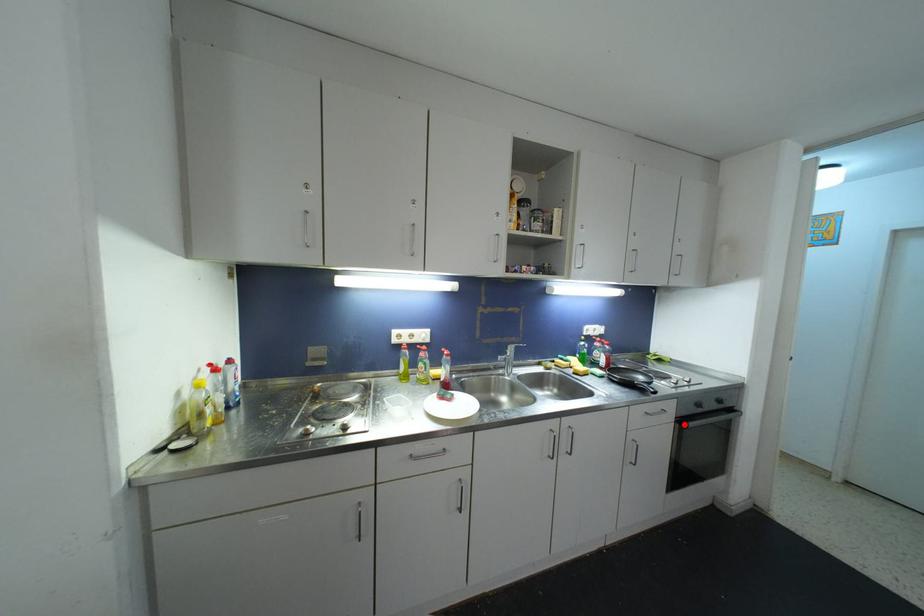
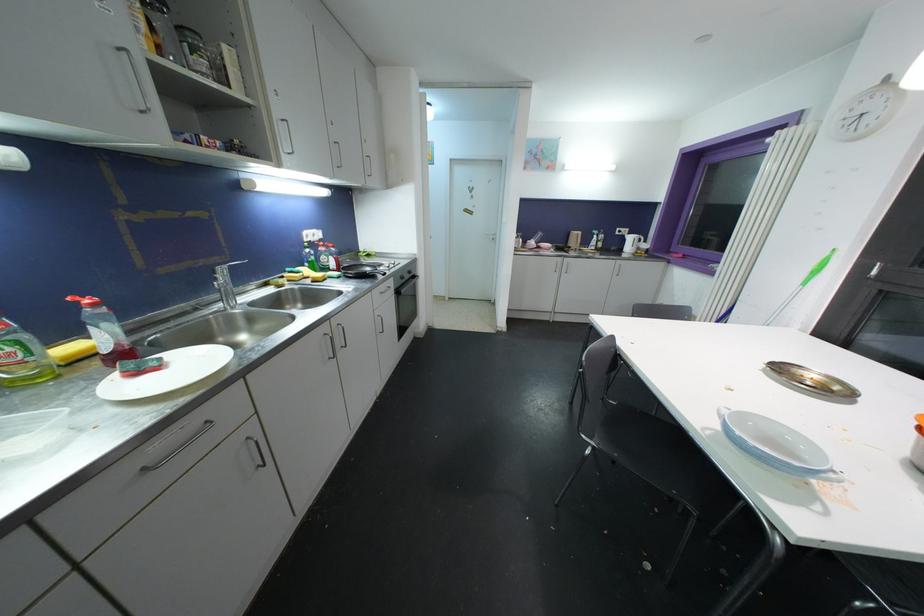
Question: I am providing you with two images of the same scene from different viewpoints. Image1 has a red point marked. In image2, the corresponding 3D location appears at what relative position? Reply with the corresponding letter.

Choices:
 (A) Closer
 (B) Farther

Answer: (A)